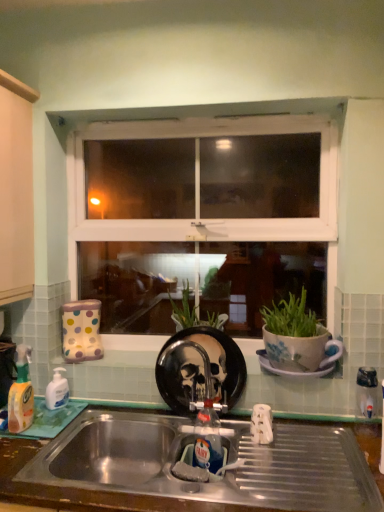
Question: Could you tell me if translucent plastic bottle at left, the first bottle from the front, is turned towards green leafy plant at center?

Choices:
 (A) yes
 (B) no

Answer: (B)

Question: Considering the relative positions of translucent plastic bottle at left, the first bottle from the front, and green leafy plant at center in the image provided, is translucent plastic bottle at left, the first bottle from the front, to the left of green leafy plant at center from the viewer's perspective?

Choices:
 (A) no
 (B) yes

Answer: (B)

Question: From the image's perspective, is translucent plastic bottle at left, the first bottle from the front, under green leafy plant at center?

Choices:
 (A) no
 (B) yes

Answer: (B)

Question: Is translucent plastic bottle at left, the first bottle from the front, wider than green leafy plant at center?

Choices:
 (A) no
 (B) yes

Answer: (A)

Question: Is translucent plastic bottle at left, the first bottle from the front, outside of green leafy plant at center?

Choices:
 (A) yes
 (B) no

Answer: (A)

Question: Can green leafy plant at center be found inside translucent plastic bottle at left, the first bottle from the front?

Choices:
 (A) yes
 (B) no

Answer: (B)

Question: From a real-world perspective, is stainless steel sink at lower center located beneath white opaque plastic bottle at left, arranged as the second bottle when viewed from the front?

Choices:
 (A) no
 (B) yes

Answer: (B)

Question: Is stainless steel sink at lower center facing away from white opaque plastic bottle at left, arranged as the second bottle when viewed from the front?

Choices:
 (A) yes
 (B) no

Answer: (B)

Question: Is stainless steel sink at lower center to the left of white opaque plastic bottle at left, arranged as the second bottle when viewed from the front, from the viewer's perspective?

Choices:
 (A) no
 (B) yes

Answer: (A)

Question: Can white opaque plastic bottle at left, the first bottle when ordered from back to front, be found inside stainless steel sink at lower center?

Choices:
 (A) no
 (B) yes

Answer: (A)

Question: From the image's perspective, is stainless steel sink at lower center located above white opaque plastic bottle at left, arranged as the second bottle when viewed from the front?

Choices:
 (A) no
 (B) yes

Answer: (A)

Question: Is stainless steel sink at lower center wider than white opaque plastic bottle at left, arranged as the second bottle when viewed from the front?

Choices:
 (A) yes
 (B) no

Answer: (A)

Question: Is translucent plastic bottle at left, which is the second bottle from back to front, next to white opaque plastic bottle at left, the first bottle when ordered from back to front?

Choices:
 (A) no
 (B) yes

Answer: (A)